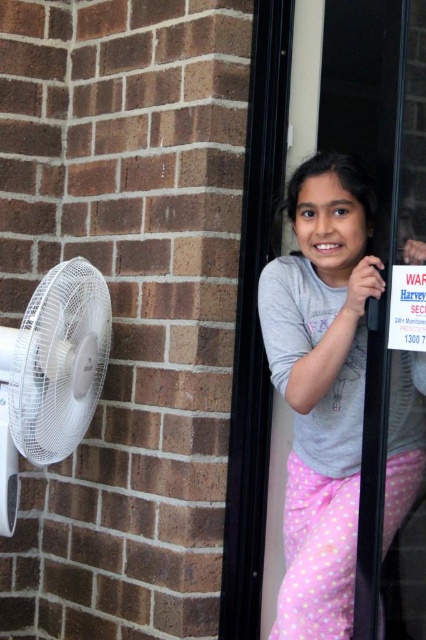
You are a photographer setting up a shoot in the scene described. You need to ensure that both the gray cotton shirt at upper right and the white paper sign at upper right are clearly visible in the frame. Given their sizes, which object should you focus on first to ensure proper exposure?

The gray cotton shirt at upper right has a larger size compared to the white paper sign at upper right, so you should focus on the gray cotton shirt at upper right first to ensure proper exposure.

From the picture: You are a painter who needs to hang a new picture frame that is 1 meter tall. You see the white plastic fan at left and the white paper sign at upper right in the scene. Which object can you place the frame next to without it blocking the fan or the sign?

The white plastic fan at left is taller than the white paper sign at upper right. Since the picture frame is 1 meter tall, you can place it next to the white paper sign at upper right because the sign is shorter, allowing the frame to be placed without blocking it. However, placing it next to the fan might cause the frame to block the fan due to its greater height.